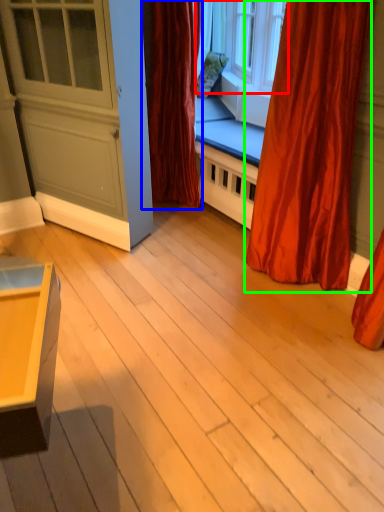
Question: Which is nearer to the window (highlighted by a red box)? curtain (highlighted by a blue box) or curtain (highlighted by a green box).

Choices:
 (A) curtain
 (B) curtain

Answer: (A)